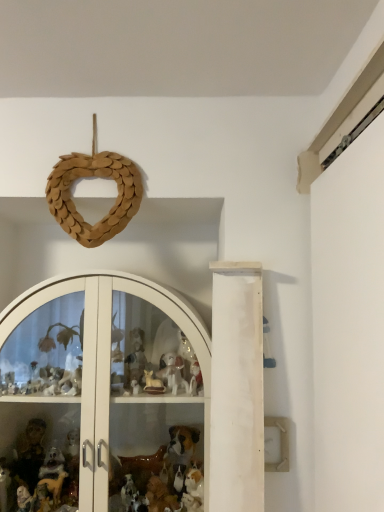
Question: Is point (92, 278) closer or farther from the camera than point (69, 224)?

Choices:
 (A) closer
 (B) farther

Answer: (A)

Question: Looking at their shapes, would you say white glossy glass door at center is wider or thinner than wooden heart at upper center?

Choices:
 (A) thin
 (B) wide

Answer: (B)

Question: Is white glossy glass door at center bigger or smaller than wooden heart at upper center?

Choices:
 (A) big
 (B) small

Answer: (A)

Question: In terms of width, does wooden heart at upper center look wider or thinner when compared to white glossy glass door at center?

Choices:
 (A) wide
 (B) thin

Answer: (B)

Question: Is point click(82, 231) closer or farther from the camera than point click(177, 324)?

Choices:
 (A) farther
 (B) closer

Answer: (A)

Question: Would you say wooden heart at upper center is to the left or to the right of white glossy glass door at center in the picture?

Choices:
 (A) right
 (B) left

Answer: (A)

Question: From the image's perspective, is wooden heart at upper center positioned above or below white glossy glass door at center?

Choices:
 (A) below
 (B) above

Answer: (B)